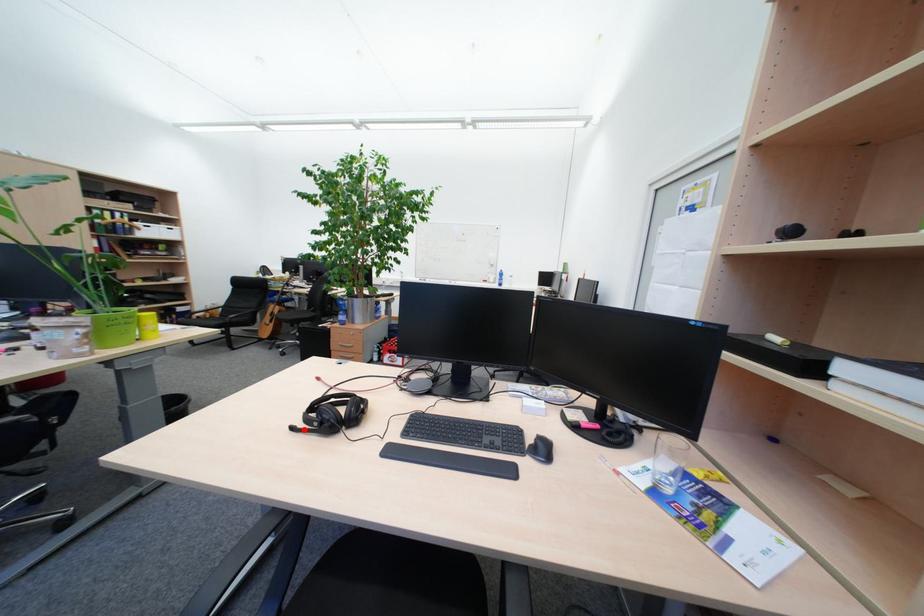
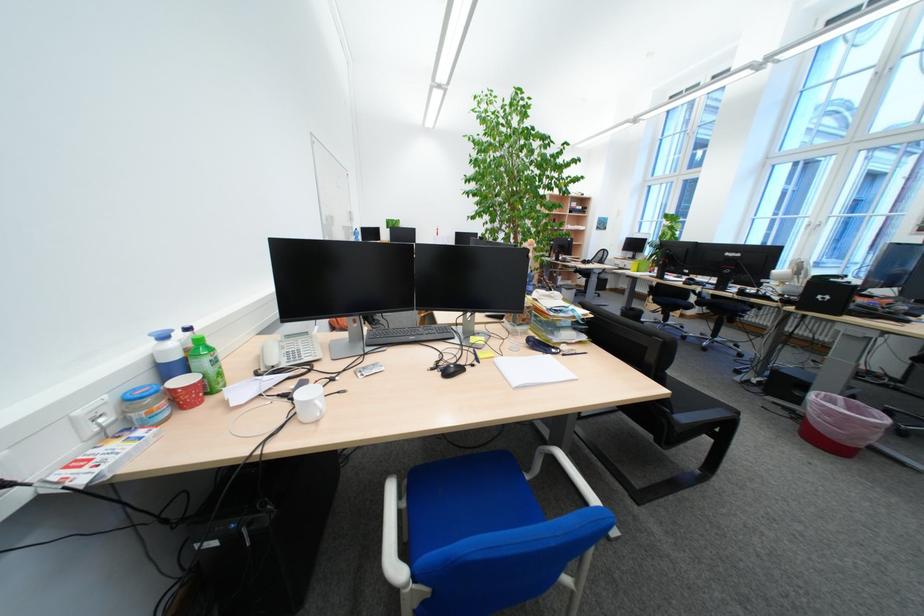
Question: I am providing you with two images of the same scene from different viewpoints. A red point is marked on the first image. Is the red point's position out of view in image 2?

Choices:
 (A) Yes
 (B) No

Answer: (A)